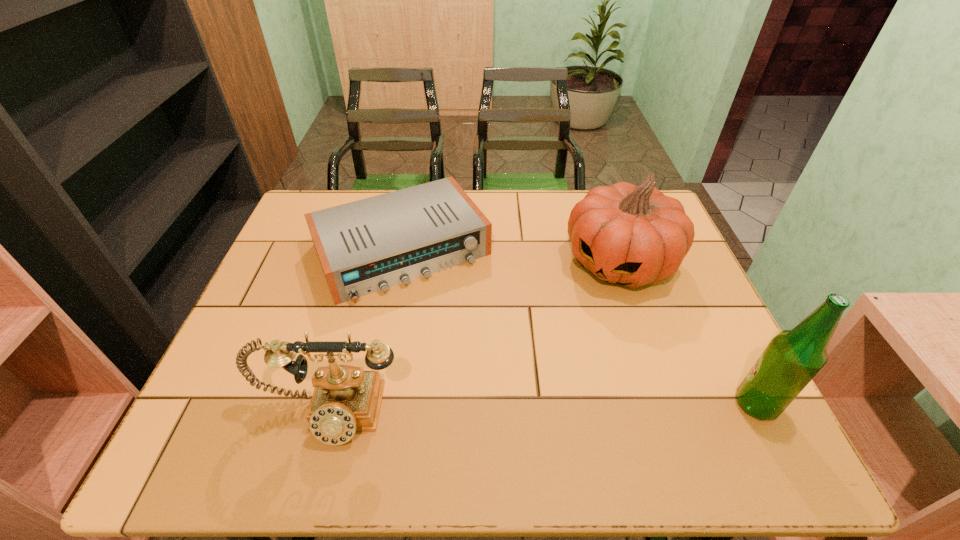
Where is `vacant space located 0.050m on the front panel of the shortest object`? Image resolution: width=960 pixels, height=540 pixels. vacant space located 0.050m on the front panel of the shortest object is located at coordinates (444, 313).

Find the location of a particular element. The height and width of the screenshot is (540, 960). free space located on the front panel of the shortest object is located at coordinates click(x=479, y=374).

This screenshot has height=540, width=960. I want to click on vacant space situated 0.160m on the front panel of the shortest object, so click(462, 345).

Find the location of a particular element. The height and width of the screenshot is (540, 960). pumpkin that is at the far edge is located at coordinates (632, 235).

Locate an element on the screen. This screenshot has width=960, height=540. radio receiver that is at the far edge is located at coordinates (365, 246).

Where is `telephone that is at the near edge`? The width and height of the screenshot is (960, 540). telephone that is at the near edge is located at coordinates (346, 399).

The width and height of the screenshot is (960, 540). Identify the location of beer bottle present at the near edge. (792, 359).

Find the location of `telephone situated at the left edge`. telephone situated at the left edge is located at coordinates [346, 399].

Where is `radio receiver at the left edge`? This screenshot has width=960, height=540. radio receiver at the left edge is located at coordinates (365, 246).

Identify the location of beer bottle that is at the right edge. The width and height of the screenshot is (960, 540). (792, 359).